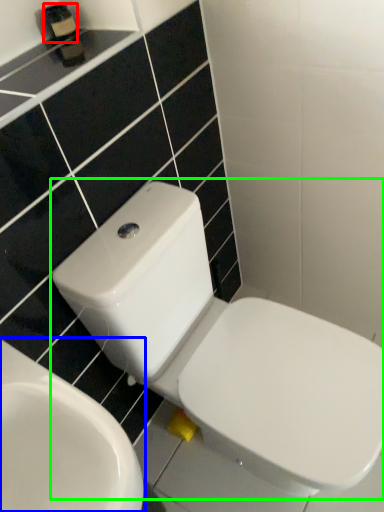
Question: Based on their relative distances, which object is nearer to toiletry (highlighted by a red box)? Choose from toilet (highlighted by a blue box) and toilet (highlighted by a green box).

Choices:
 (A) toilet
 (B) toilet

Answer: (B)